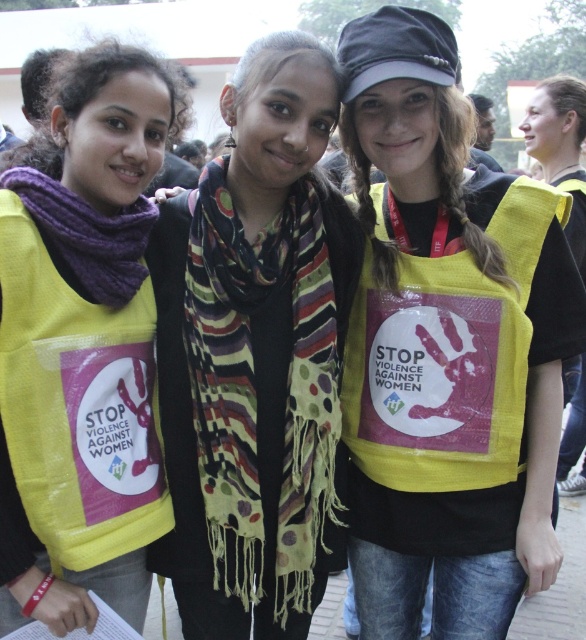
You are at a protest event and need to identify the position of the scarves. Which scarf is positioned lower between the multicolored woven scarf at center and the purple knitted scarf at left?

The multicolored woven scarf at center is located below the purple knitted scarf at left, so it is positioned lower.

You are at an outdoor event and see two items in the image. One is a multicolored woven scarf at center and the other is a matte yellow vest at right. Which item is positioned to the left of the other?

The multicolored woven scarf at center is to the left of matte yellow vest at right.